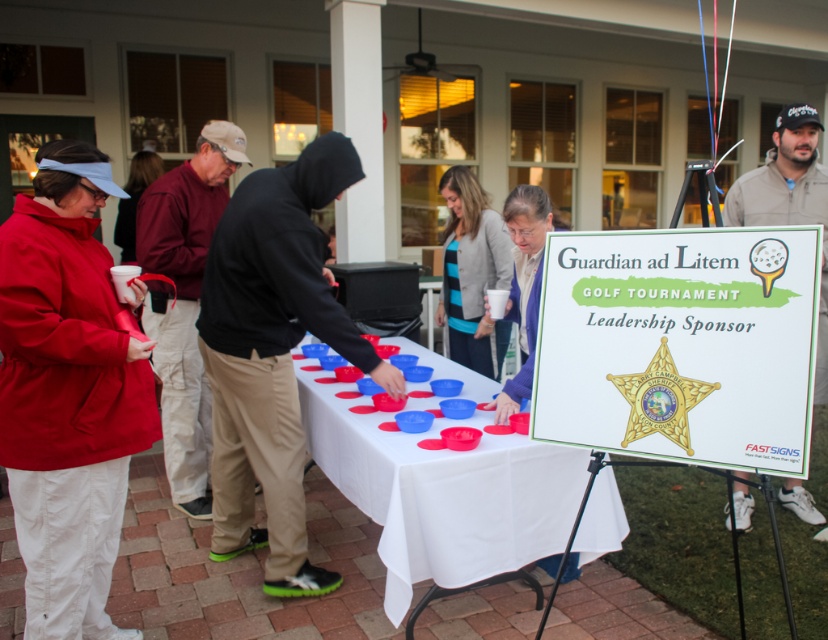
Can you confirm if white cloth table at center is positioned to the left of khaki pants at center?

Yes, white cloth table at center is to the left of khaki pants at center.

Can you confirm if white cloth table at center is bigger than khaki pants at center?

Correct, white cloth table at center is larger in size than khaki pants at center.

The image size is (828, 640). I want to click on white cloth table at center, so click(x=441, y=492).

In the scene shown: Which is below, red nylon jacket at left or white cloth table at center?

Positioned lower is white cloth table at center.

This screenshot has width=828, height=640. Describe the element at coordinates (66, 394) in the screenshot. I see `red nylon jacket at left` at that location.

Locate an element on the screen. red nylon jacket at left is located at coordinates (66, 394).

Between maroon fabric jacket at center and khaki pants at center, which one has more height?

Standing taller between the two is maroon fabric jacket at center.

Is point (183, 456) in front of point (824, 356)?

No, (183, 456) is behind (824, 356).

Is point (179, 472) farther from camera compared to point (822, 179)?

Yes, point (179, 472) is behind point (822, 179).

At what (x,y) coordinates should I click in order to perform the action: click on maroon fabric jacket at center. Please return your answer as a coordinate pair (x, y). The height and width of the screenshot is (640, 828). Looking at the image, I should click on (184, 300).